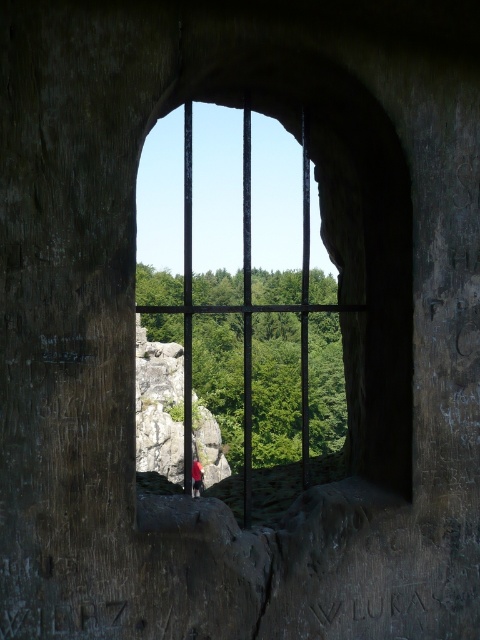
You are an architect designing a replica of this stone window. You need to place a decorative element exactly at the center of the black metal bars at center. Where should you position it according to the 2D coordinates provided?

The decorative element should be placed at the 2D coordinates point (x=243, y=305), which is the center of the black metal bars at center.

You are standing inside a castle and looking through the stone window. You see a red fabric person at center and black metal bars at center. Which object is closer to the right edge of the window?

The black metal bars at center are positioned on the right side of the red fabric person at center, so the black metal bars at center are closer to the right edge of the window.

You are standing at the camera position looking through the stone window. There is a point marked at coordinates (250, 458). If you want to touch this point with a stick that is 12 feet long, will the stick be long enough?

The point at coordinates (250, 458) is 14.02 feet away from the camera position. Since the stick is only 12 feet long, it will not be long enough to reach the point.